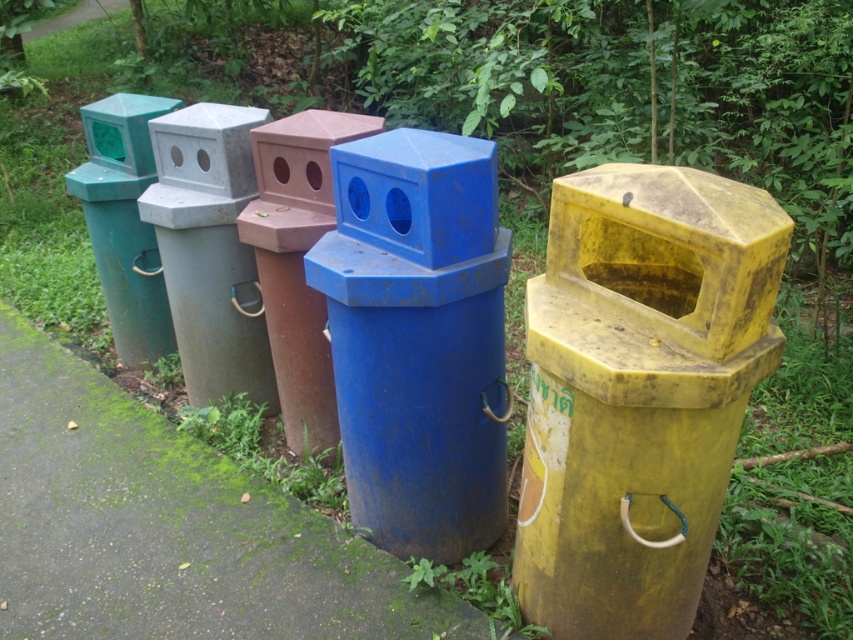
Which is more to the right, yellow matte trash can at center or smooth concrete pavement at center?

yellow matte trash can at center

Can you confirm if yellow matte trash can at center is wider than smooth concrete pavement at center?

In fact, yellow matte trash can at center might be narrower than smooth concrete pavement at center.

Identify the location of yellow matte trash can at center. (639, 390).

Between smooth concrete pavement at center and matte green plastic trash can at left, which one appears on the left side from the viewer's perspective?

matte green plastic trash can at left is more to the left.

Find the location of a particular element. smooth concrete pavement at center is located at coordinates (167, 528).

Which is behind, point (86, 509) or point (119, 99)?

Positioned behind is point (119, 99).

Where is `smooth concrete pavement at center`? The image size is (853, 640). smooth concrete pavement at center is located at coordinates (167, 528).

Which is behind, point (225, 518) or point (363, 209)?

Point (225, 518)

The image size is (853, 640). In order to click on smooth concrete pavement at center in this screenshot , I will do `click(167, 528)`.